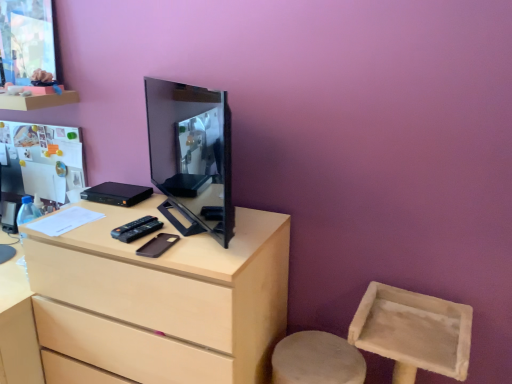
Question: From the image's perspective, is light wood chest of drawers at center below black glossy monitor at center?

Choices:
 (A) yes
 (B) no

Answer: (A)

Question: Can you confirm if light wood chest of drawers at center is thinner than black glossy monitor at center?

Choices:
 (A) no
 (B) yes

Answer: (A)

Question: Would you say black glossy monitor at center is part of light wood chest of drawers at center's contents?

Choices:
 (A) no
 (B) yes

Answer: (A)

Question: From a real-world perspective, is light wood chest of drawers at center below black glossy monitor at center?

Choices:
 (A) no
 (B) yes

Answer: (B)

Question: Is black glossy monitor at center at the back of light wood chest of drawers at center?

Choices:
 (A) yes
 (B) no

Answer: (B)

Question: Can you confirm if light wood chest of drawers at center is wider than black glossy monitor at center?

Choices:
 (A) no
 (B) yes

Answer: (B)

Question: Is black glossy monitor at center not near matte wood shelf at upper left?

Choices:
 (A) no
 (B) yes

Answer: (A)

Question: From a real-world perspective, does black glossy monitor at center stand above matte wood shelf at upper left?

Choices:
 (A) no
 (B) yes

Answer: (A)

Question: Can you confirm if black glossy monitor at center is shorter than matte wood shelf at upper left?

Choices:
 (A) no
 (B) yes

Answer: (A)

Question: From the image's perspective, is black glossy monitor at center over matte wood shelf at upper left?

Choices:
 (A) no
 (B) yes

Answer: (A)

Question: Is black glossy monitor at center located outside matte wood shelf at upper left?

Choices:
 (A) yes
 (B) no

Answer: (A)

Question: Is matte wood shelf at upper left located within black glossy monitor at center?

Choices:
 (A) no
 (B) yes

Answer: (A)

Question: Is black glossy monitor at center wider than light wood chest of drawers at center?

Choices:
 (A) yes
 (B) no

Answer: (B)